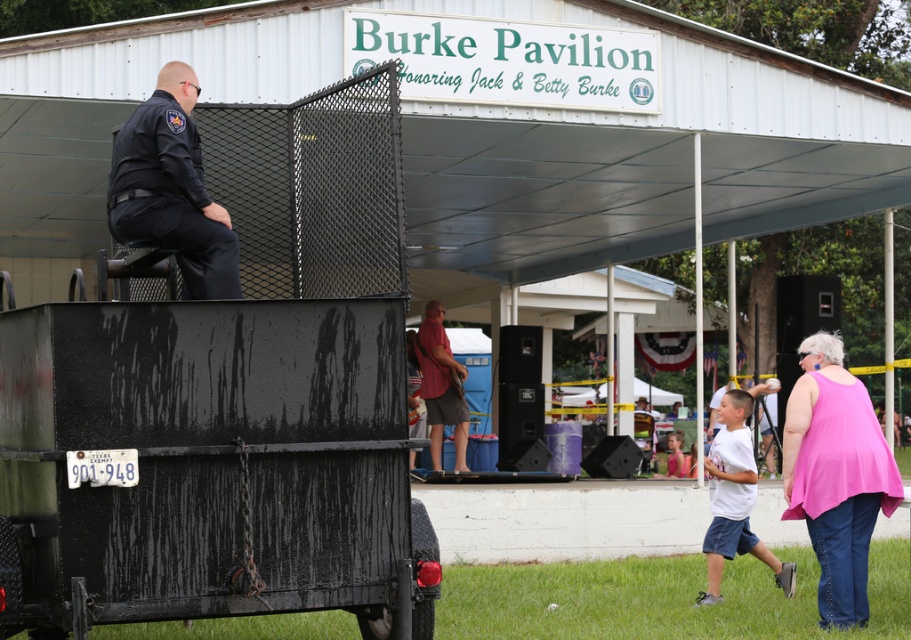
You are a photographer trying to capture a candid shot of the two people wearing the pink fabric tank top at lower right and the white matte shirt at lower right. Since you want to ensure both are visible in the frame, which clothing item should you focus on to frame the shot appropriately?

The white matte shirt at lower right occupies more space than the pink fabric tank top at lower right, so focusing on the white matte shirt at lower right will help ensure both are visible in the frame.

What is the exact position of the pink fabric tank top at lower right?

The pink fabric tank top at lower right is located at point (836, 476).